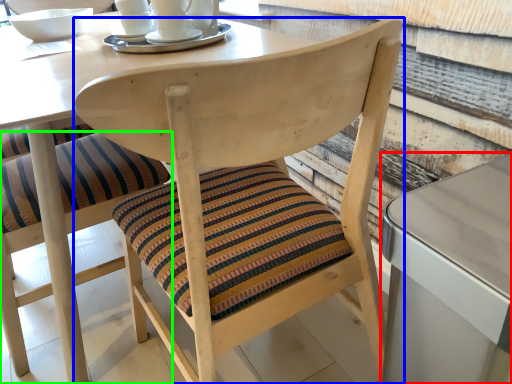
Question: Considering the real-world distances, which object is closest to table (highlighted by a red box)? chair (highlighted by a blue box) or chair (highlighted by a green box).

Choices:
 (A) chair
 (B) chair

Answer: (A)